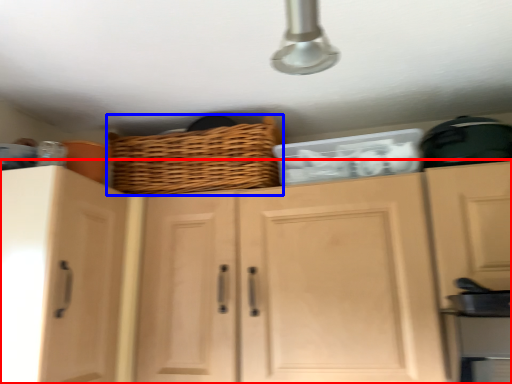
Question: Among these objects, which one is farthest to the camera, cabinetry (highlighted by a red box) or basket (highlighted by a blue box)?

Choices:
 (A) cabinetry
 (B) basket

Answer: (B)